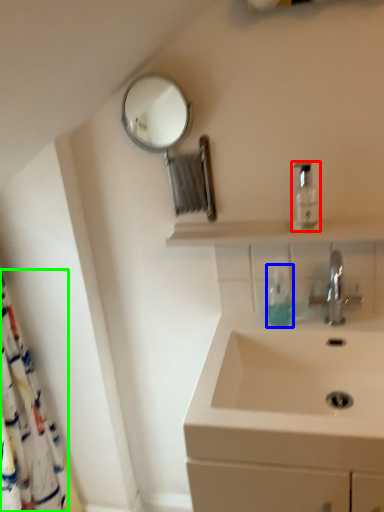
Question: Which is nearer to the mouthwash (highlighted by a red box)? soap dispenser (highlighted by a blue box) or shower curtain (highlighted by a green box).

Choices:
 (A) soap dispenser
 (B) shower curtain

Answer: (A)